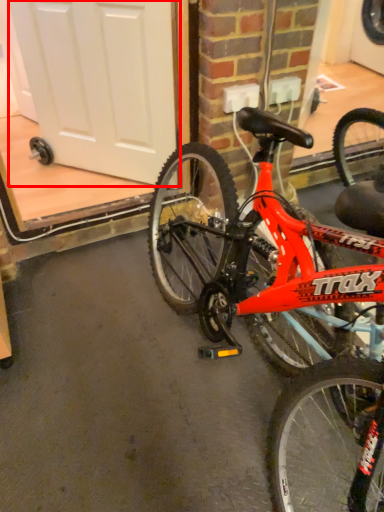
Question: From the image's perspective, where is screen door (annotated by the red box) located relative to bicycle?

Choices:
 (A) below
 (B) above

Answer: (B)